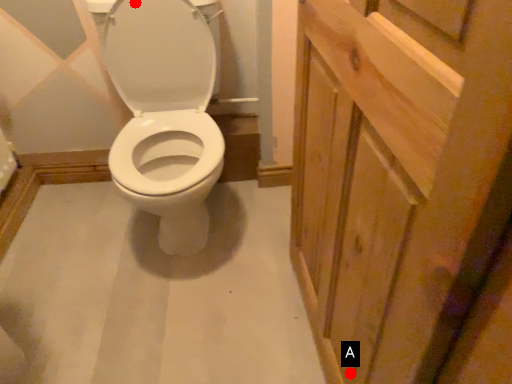
Question: Two points are circled on the image, labeled by A and B beside each circle. Which point appears closest to the camera in this image?

Choices:
 (A) A is closer
 (B) B is closer

Answer: (A)